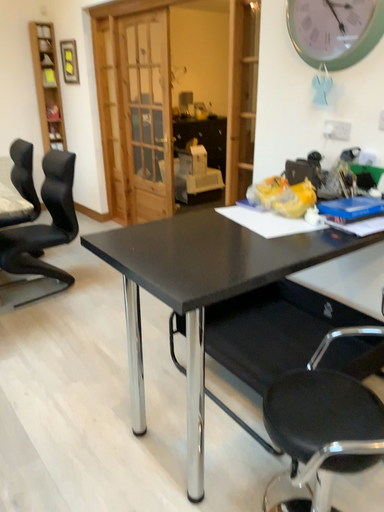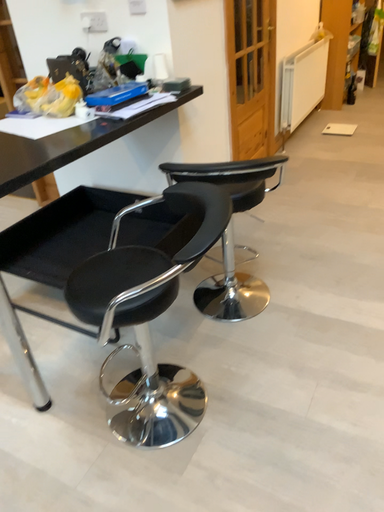
Question: How did the camera likely rotate when shooting the video?

Choices:
 (A) rotated right
 (B) rotated left

Answer: (A)